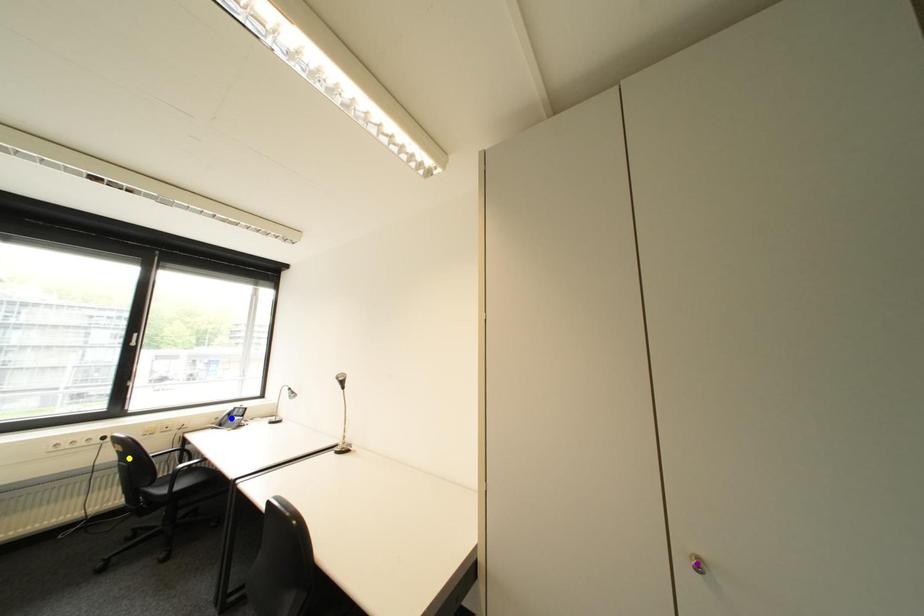
Order these from nearest to farthest:
yellow point | blue point | purple point

blue point < yellow point < purple point